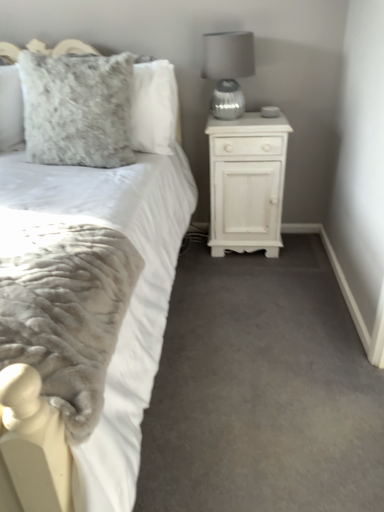
Locate an element on the screen. This screenshot has height=512, width=384. vacant point to the left of white wood nightstand at right is located at coordinates (192, 252).